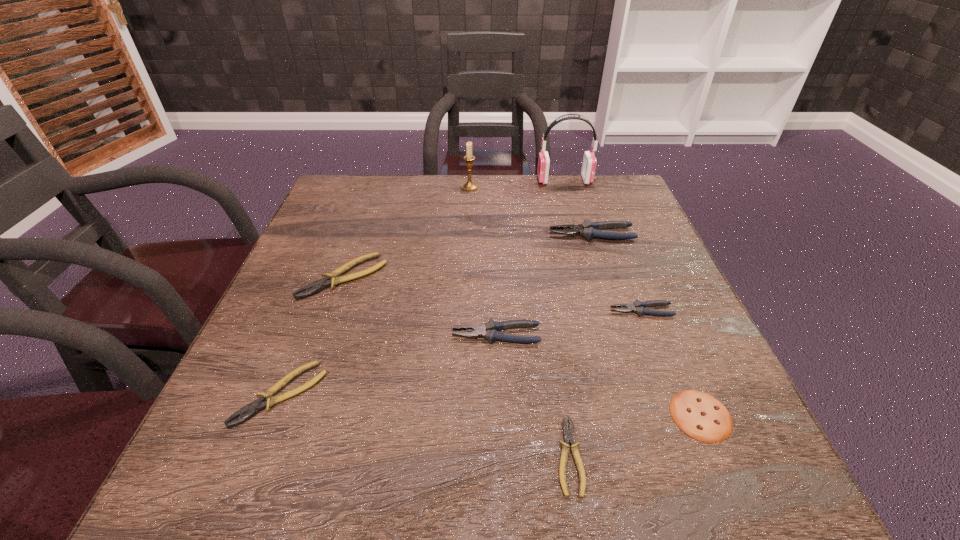
The height and width of the screenshot is (540, 960). In order to click on free space at the left edge of the desktop in this screenshot , I will do `click(285, 275)`.

The width and height of the screenshot is (960, 540). In the image, there is a desktop. In order to click on vacant space at the right edge in this screenshot , I will do `click(730, 410)`.

In the image, there is a desktop. Where is `vacant space at the far left corner`? vacant space at the far left corner is located at coordinates (356, 187).

Image resolution: width=960 pixels, height=540 pixels. What are the coordinates of `vacant space at the near left corner` in the screenshot? It's located at (254, 500).

The height and width of the screenshot is (540, 960). In the image, there is a desktop. What are the coordinates of `vacant area at the far right corner` in the screenshot? It's located at (624, 185).

The width and height of the screenshot is (960, 540). What are the coordinates of `vacant space at the near right corner of the desktop` in the screenshot? It's located at (660, 449).

Locate an element on the screen. vacant space in between the candle holder and the leftmost gray pliers is located at coordinates (483, 261).

Locate an element on the screen. free point between the cookie and the second farthest pliers is located at coordinates (522, 346).

Where is `free area in between the second biggest yellow pliers and the candle holder`? This screenshot has width=960, height=540. free area in between the second biggest yellow pliers and the candle holder is located at coordinates (375, 291).

Find the location of a particular element. Image resolution: width=960 pixels, height=540 pixels. vacant area that lies between the fourth nearest pliers and the tallest pliers is located at coordinates (616, 272).